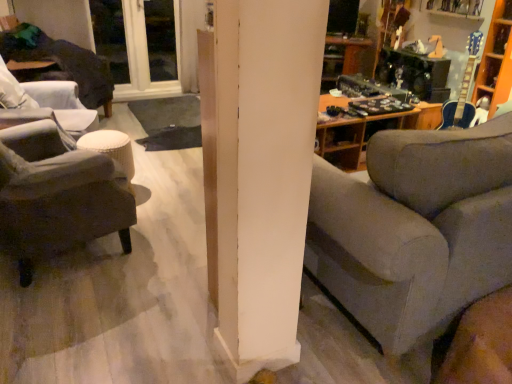
This screenshot has height=384, width=512. What do you see at coordinates (59, 201) in the screenshot? I see `dark gray fabric ottoman at left, the 1th chair positioned from the bottom` at bounding box center [59, 201].

Where is `dark gray fabric ottoman at left, the 2th chair viewed from the back`? This screenshot has width=512, height=384. dark gray fabric ottoman at left, the 2th chair viewed from the back is located at coordinates (59, 201).

The height and width of the screenshot is (384, 512). I want to click on dark fabric chair at left, which ranks as the second chair in bottom-to-top order, so click(x=48, y=101).

What do you see at coordinates (138, 44) in the screenshot?
I see `white plastic window at upper left` at bounding box center [138, 44].

The height and width of the screenshot is (384, 512). In order to click on dark gray fabric ottoman at left, arranged as the first chair when viewed from the front in this screenshot , I will do `click(59, 201)`.

Does gray fabric couch at center have a smaller size compared to dark gray fabric ottoman at left, the 2th chair positioned from the top?

No.

Where is `the 1st chair to the left of the gray fabric couch at center, starting your count from the anchor`? the 1st chair to the left of the gray fabric couch at center, starting your count from the anchor is located at coordinates (59, 201).

From the picture: Is dark gray fabric ottoman at left, the 2th chair viewed from the back, surrounded by gray fabric couch at center?

No, dark gray fabric ottoman at left, the 2th chair viewed from the back, is not a part of gray fabric couch at center.

Is gray fabric couch at center looking in the opposite direction of dark gray fabric ottoman at left, the 1th chair positioned from the bottom?

No, gray fabric couch at center's orientation is not away from dark gray fabric ottoman at left, the 1th chair positioned from the bottom.

Which object is closer to the camera taking this photo, gray fabric couch at center or white plastic window at upper left?

Positioned in front is gray fabric couch at center.

Measure the distance from gray fabric couch at center to white plastic window at upper left.

A distance of 10.51 feet exists between gray fabric couch at center and white plastic window at upper left.

From a real-world perspective, relative to white plastic window at upper left, is gray fabric couch at center vertically above or below?

From a real-world perspective, gray fabric couch at center is physically below white plastic window at upper left.

From the image's perspective, which is below, gray fabric couch at center or white plastic window at upper left?

gray fabric couch at center, from the image's perspective.

Is dark gray fabric ottoman at left, the 1th chair positioned from the bottom, to the left or to the right of burlap-textured stool at left in the image?

From the image, it's evident that dark gray fabric ottoman at left, the 1th chair positioned from the bottom, is to the left of burlap-textured stool at left.

Considering the points (87, 157) and (89, 142), which point is in front, point (87, 157) or point (89, 142)?

The point (87, 157) is more forward.

From the image's perspective, between dark gray fabric ottoman at left, the 1th chair positioned from the bottom, and burlap-textured stool at left, who is located below?

dark gray fabric ottoman at left, the 1th chair positioned from the bottom, appears lower in the image.

Does dark gray fabric ottoman at left, arranged as the first chair when viewed from the front, have a lesser height compared to burlap-textured stool at left?

In fact, dark gray fabric ottoman at left, arranged as the first chair when viewed from the front, may be taller than burlap-textured stool at left.

Does gray fabric couch at center have a lesser height compared to dark fabric chair at left, the 1th chair viewed from the top?

No.

Could you tell me if gray fabric couch at center is facing dark fabric chair at left, acting as the second chair starting from the front?

Yes, gray fabric couch at center is facing dark fabric chair at left, acting as the second chair starting from the front.

Looking at this image, from the image's perspective, which one is positioned higher, gray fabric couch at center or dark fabric chair at left, which is the first chair in back-to-front order?

dark fabric chair at left, which is the first chair in back-to-front order.

How different are the orientations of gray fabric couch at center and dark fabric chair at left, acting as the second chair starting from the front, in degrees?

128 degrees.

Which is closer, (9, 102) or (118, 231)?

The point (118, 231) is closer.

In the scene shown: How different are the orientations of dark fabric chair at left, which is the first chair in back-to-front order, and dark gray fabric ottoman at left, the 2th chair positioned from the top, in degrees?

The facing directions of dark fabric chair at left, which is the first chair in back-to-front order, and dark gray fabric ottoman at left, the 2th chair positioned from the top, are 55.5 degrees apart.

You are a GUI agent. You are given a task and a screenshot of the screen. Output one action in this format:
    pyautogui.click(x=<x>, y=<y>)
    Task: Click on the chair above the dark fabric chair at left, which is the first chair in back-to-front order (from a real-world perspective)
    The image size is (512, 384).
    Given the screenshot: What is the action you would take?
    pyautogui.click(x=59, y=201)

Which is in front, dark fabric chair at left, which is the first chair in back-to-front order, or dark gray fabric ottoman at left, the 2th chair positioned from the top?

dark gray fabric ottoman at left, the 2th chair positioned from the top, is more forward.

Considering the positions of point (159, 19) and point (419, 300), is point (159, 19) closer or farther from the camera than point (419, 300)?

Point (159, 19) is positioned farther from the camera compared to point (419, 300).

In terms of width, does white plastic window at upper left look wider or thinner when compared to gray fabric couch at center?

In the image, white plastic window at upper left appears to be more narrow than gray fabric couch at center.

Between white plastic window at upper left and gray fabric couch at center, which one has smaller size?

With smaller size is white plastic window at upper left.

Is white plastic window at upper left located within dark gray fabric ottoman at left, arranged as the first chair when viewed from the front?

No, white plastic window at upper left is not a part of dark gray fabric ottoman at left, arranged as the first chair when viewed from the front.

Considering the relative sizes of dark gray fabric ottoman at left, the 2th chair positioned from the top, and white plastic window at upper left in the image provided, is dark gray fabric ottoman at left, the 2th chair positioned from the top, bigger than white plastic window at upper left?

Yes, dark gray fabric ottoman at left, the 2th chair positioned from the top, is bigger than white plastic window at upper left.

Looking at this image, from a real-world perspective, is dark gray fabric ottoman at left, arranged as the first chair when viewed from the front, under white plastic window at upper left?

Yes.

Is dark gray fabric ottoman at left, arranged as the first chair when viewed from the front, in contact with white plastic window at upper left?

No, dark gray fabric ottoman at left, arranged as the first chair when viewed from the front, is not beside white plastic window at upper left.

Locate an element on the screen. The image size is (512, 384). the 1st chair to the left of the gray fabric couch at center, starting your count from the anchor is located at coordinates (59, 201).

Image resolution: width=512 pixels, height=384 pixels. I want to click on window behind the gray fabric couch at center, so click(x=138, y=44).

Based on the photo, based on their spatial positions, is dark gray fabric ottoman at left, arranged as the first chair when viewed from the front, or dark fabric chair at left, which is the first chair in back-to-front order, closer to gray fabric couch at center?

dark gray fabric ottoman at left, arranged as the first chair when viewed from the front.

Based on the photo, when comparing their distances from dark fabric chair at left, acting as the second chair starting from the front, does gray fabric couch at center or white plastic window at upper left seem closer?

white plastic window at upper left is positioned closer to the anchor dark fabric chair at left, acting as the second chair starting from the front.

When comparing their distances from white plastic window at upper left, does dark fabric chair at left, which ranks as the second chair in bottom-to-top order, or burlap-textured stool at left seem closer?

The object closer to white plastic window at upper left is dark fabric chair at left, which ranks as the second chair in bottom-to-top order.

Estimate the real-world distances between objects in this image. Which object is closer to gray fabric couch at center, dark fabric chair at left, the 1th chair viewed from the top, or white plastic window at upper left?

Based on the image, dark fabric chair at left, the 1th chair viewed from the top, appears to be nearer to gray fabric couch at center.

When comparing their distances from burlap-textured stool at left, does white plastic window at upper left or dark gray fabric ottoman at left, the 1th chair positioned from the bottom, seem closer?

Based on the image, dark gray fabric ottoman at left, the 1th chair positioned from the bottom, appears to be nearer to burlap-textured stool at left.

Based on their spatial positions, is burlap-textured stool at left or dark gray fabric ottoman at left, the 1th chair positioned from the bottom, further from white plastic window at upper left?

The object further to white plastic window at upper left is dark gray fabric ottoman at left, the 1th chair positioned from the bottom.

Looking at the image, which one is located closer to burlap-textured stool at left, gray fabric couch at center or dark fabric chair at left, which is the first chair in back-to-front order?

dark fabric chair at left, which is the first chair in back-to-front order, lies closer to burlap-textured stool at left than the other object.

When comparing their distances from white plastic window at upper left, does gray fabric couch at center or dark gray fabric ottoman at left, arranged as the first chair when viewed from the front, seem further?

gray fabric couch at center.

You are a GUI agent. You are given a task and a screenshot of the screen. Output one action in this format:
    pyautogui.click(x=<x>, y=<y>)
    Task: Click on the stool between gray fabric couch at center and white plastic window at upper left in the front-back direction
    
    Given the screenshot: What is the action you would take?
    pyautogui.click(x=111, y=148)

Where is `chair positioned between dark gray fabric ottoman at left, the 1th chair positioned from the bottom, and white plastic window at upper left from near to far`? Image resolution: width=512 pixels, height=384 pixels. chair positioned between dark gray fabric ottoman at left, the 1th chair positioned from the bottom, and white plastic window at upper left from near to far is located at coordinates (48, 101).

At what (x,y) coordinates should I click in order to perform the action: click on stool between dark gray fabric ottoman at left, arranged as the first chair when viewed from the front, and white plastic window at upper left, along the z-axis. Please return your answer as a coordinate pair (x, y). The height and width of the screenshot is (384, 512). Looking at the image, I should click on (111, 148).

At what (x,y) coordinates should I click in order to perform the action: click on stool between dark fabric chair at left, which is the first chair in back-to-front order, and gray fabric couch at center. Please return your answer as a coordinate pair (x, y). Looking at the image, I should click on (111, 148).